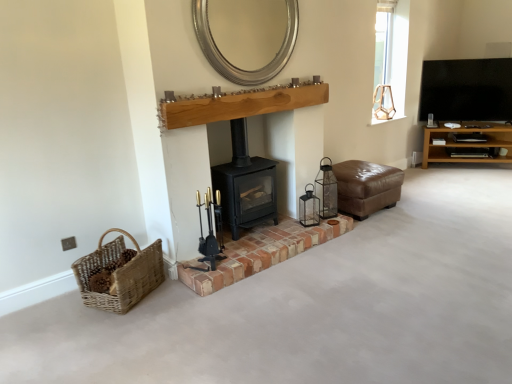
Question: Considering the relative sizes of brown leather ottoman at center-right and silver metallic mirror at upper center in the image provided, is brown leather ottoman at center-right smaller than silver metallic mirror at upper center?

Choices:
 (A) yes
 (B) no

Answer: (B)

Question: From a real-world perspective, is brown leather ottoman at center-right beneath silver metallic mirror at upper center?

Choices:
 (A) no
 (B) yes

Answer: (B)

Question: Is brown leather ottoman at center-right directly adjacent to silver metallic mirror at upper center?

Choices:
 (A) yes
 (B) no

Answer: (B)

Question: Can you confirm if brown leather ottoman at center-right is positioned to the right of silver metallic mirror at upper center?

Choices:
 (A) no
 (B) yes

Answer: (B)

Question: Is brown leather ottoman at center-right closer to the viewer compared to silver metallic mirror at upper center?

Choices:
 (A) yes
 (B) no

Answer: (B)

Question: In the image, is brown wooden shelf at right positioned in front of or behind black matte wood burning stove at center?

Choices:
 (A) front
 (B) behind

Answer: (B)

Question: Is point (484, 122) positioned closer to the camera than point (266, 162)?

Choices:
 (A) farther
 (B) closer

Answer: (A)

Question: Looking at the image, does brown wooden shelf at right seem bigger or smaller compared to black matte wood burning stove at center?

Choices:
 (A) big
 (B) small

Answer: (A)

Question: Is brown wooden shelf at right taller or shorter than black matte wood burning stove at center?

Choices:
 (A) short
 (B) tall

Answer: (A)

Question: Visually, is metallic lantern at center, which is the second candle holder from left to right, positioned to the left or to the right of clear glass window at upper right?

Choices:
 (A) left
 (B) right

Answer: (A)

Question: Is metallic lantern at center, acting as the first candle holder starting from the back, bigger or smaller than clear glass window at upper right?

Choices:
 (A) small
 (B) big

Answer: (A)

Question: From the image's perspective, is metallic lantern at center, acting as the first candle holder starting from the back, above or below clear glass window at upper right?

Choices:
 (A) above
 (B) below

Answer: (B)

Question: Does point (310, 195) appear closer or farther from the camera than point (402, 99)?

Choices:
 (A) farther
 (B) closer

Answer: (B)

Question: Looking at their shapes, would you say metallic lantern at center, which is the second candle holder from left to right, is wider or thinner than natural wood mantle at center?

Choices:
 (A) wide
 (B) thin

Answer: (A)

Question: From the image's perspective, relative to natural wood mantle at center, is metallic lantern at center, which is the second candle holder from left to right, above or below?

Choices:
 (A) below
 (B) above

Answer: (A)